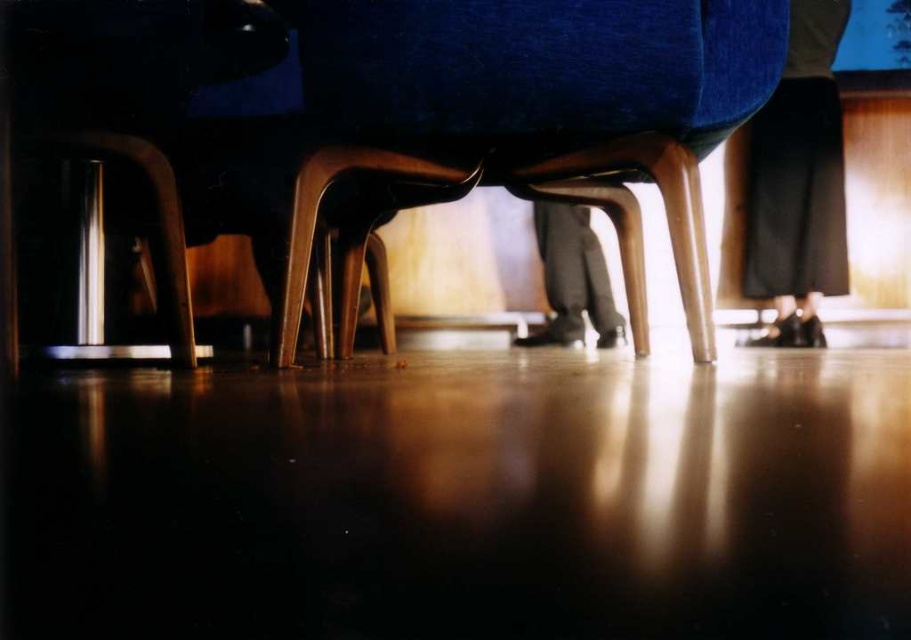
You are a photographer standing in the room and want to capture the dark gray pants at center without the velvet blue armchair at center blocking the view. Is it possible to adjust your position to achieve this?

The velvet blue armchair at center is located above dark gray pants at center, so by lowering your camera angle or moving closer to the floor, you can position yourself to see the dark gray pants at center without the armchair blocking the view.

In the scene shown: You are a delivery person trying to place a 1.2 meter long package between the velvet blue armchair at center and the wall. Is there enough space for the package?

The distance between the velvet blue armchair at center and the wall is 1.11 meters, which is shorter than the package length of 1.2 meters. Therefore, the package won not fit in that space.